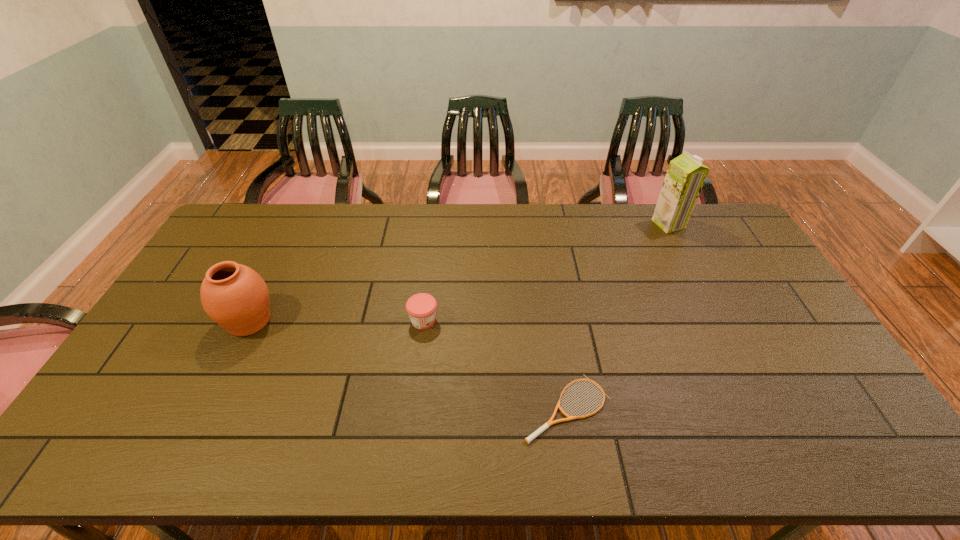
At what (x,y) coordinates should I click in order to perform the action: click on the rightmost object. Please return your answer as a coordinate pair (x, y). The width and height of the screenshot is (960, 540). Looking at the image, I should click on (685, 177).

Locate an element on the screen. This screenshot has width=960, height=540. soya milk is located at coordinates (685, 177).

You are a GUI agent. You are given a task and a screenshot of the screen. Output one action in this format:
    pyautogui.click(x=<x>, y=<y>)
    Task: Click on the second tallest object
    The height and width of the screenshot is (540, 960).
    Given the screenshot: What is the action you would take?
    pyautogui.click(x=233, y=295)

The image size is (960, 540). I want to click on the leftmost object, so click(233, 295).

Locate an element on the screen. The height and width of the screenshot is (540, 960). the second object from left to right is located at coordinates (421, 307).

Image resolution: width=960 pixels, height=540 pixels. Find the location of `jam`. jam is located at coordinates (421, 307).

Where is `the third object from left to right`? The image size is (960, 540). the third object from left to right is located at coordinates (550, 422).

Find the location of `tennis racket`. tennis racket is located at coordinates (550, 422).

The height and width of the screenshot is (540, 960). I want to click on vacant area located 0.060m on the right of the rightmost object, so click(x=700, y=224).

I want to click on vacant space located 0.320m on the front of the urn, so click(x=184, y=453).